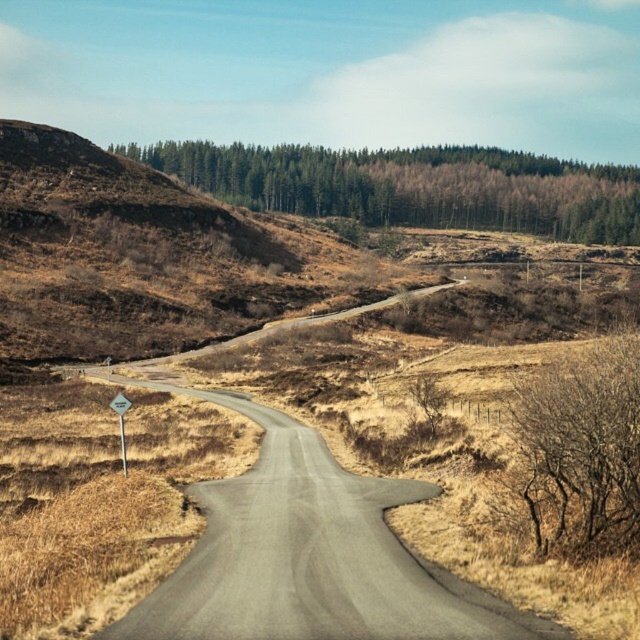
Question: Which point appears closest to the camera in this image?

Choices:
 (A) (339, 595)
 (B) (120, 392)

Answer: (A)

Question: Does bare branches at right appear over white plastic signpost at lower left?

Choices:
 (A) yes
 (B) no

Answer: (A)

Question: From the image, what is the correct spatial relationship of gray asphalt road at center in relation to bare branches at right?

Choices:
 (A) left
 (B) right

Answer: (A)

Question: Which point is farther to the camera?

Choices:
 (A) white plastic signpost at lower left
 (B) bare branches at right
 (C) green leafy trees at upper center
 (D) gray asphalt road at center

Answer: (C)

Question: Does green leafy trees at upper center appear under white plastic signpost at lower left?

Choices:
 (A) no
 (B) yes

Answer: (A)

Question: Which object is positioned closest to the white plastic diamond at left?

Choices:
 (A) gray asphalt road at center
 (B) white plastic signpost at lower left
 (C) green leafy trees at upper center
 (D) bare branches at right

Answer: (B)